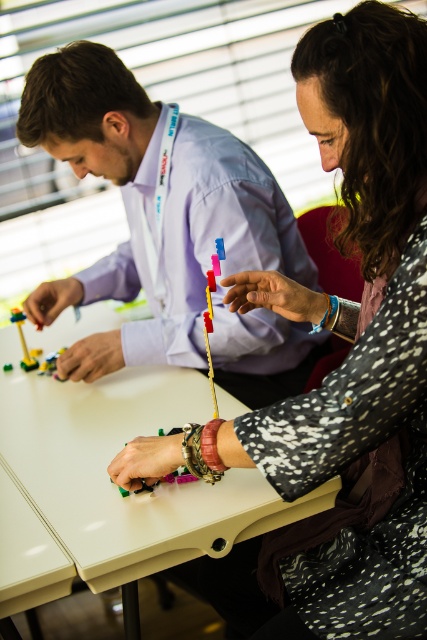
Question: Which object appears farthest from the camera in this image?

Choices:
 (A) leather-like brown bracelet at lower center
 (B) speckled fabric sweater at center
 (C) blue fabric bracelet at lower center

Answer: (C)

Question: Among these objects, which one is nearest to the camera?

Choices:
 (A) white plastic table at center
 (B) speckled fabric sweater at center

Answer: (B)

Question: Which is nearer to the translucent plastic toy at center?

Choices:
 (A) leather-like brown bracelet at lower center
 (B) white plastic table at center
 (C) speckled fabric sweater at center
 (D) blue fabric bracelet at lower center

Answer: (B)

Question: Is matte purple shirt at upper center to the right of white plastic table at center from the viewer's perspective?

Choices:
 (A) no
 (B) yes

Answer: (B)

Question: Where is leather-like brown bracelet at lower center located in relation to translucent plastic toy at center in the image?

Choices:
 (A) left
 (B) right

Answer: (B)

Question: Does translucent plastic toy at center appear under blue fabric bracelet at lower center?

Choices:
 (A) no
 (B) yes

Answer: (B)